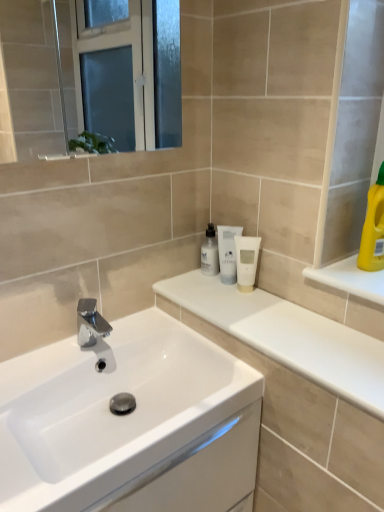
Find the location of `free space to the left of chrome/metallic faucet at center`. free space to the left of chrome/metallic faucet at center is located at coordinates (44, 362).